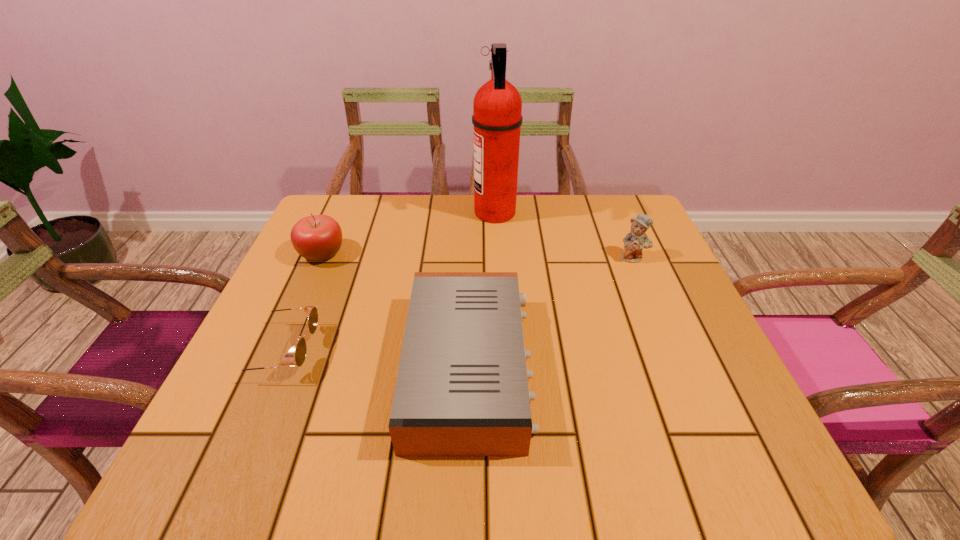
Identify the location of the farthest object. Image resolution: width=960 pixels, height=540 pixels. (497, 106).

Find the location of a particular element. Image resolution: width=960 pixels, height=540 pixels. the tallest object is located at coordinates (497, 106).

Image resolution: width=960 pixels, height=540 pixels. Find the location of `the rightmost object`. the rightmost object is located at coordinates point(635,241).

In order to click on apple in this screenshot , I will do `click(319, 237)`.

At what (x,y) coordinates should I click in order to perform the action: click on radio receiver. Please return your answer as a coordinate pair (x, y). This screenshot has width=960, height=540. Looking at the image, I should click on (462, 389).

Locate an element on the screen. The height and width of the screenshot is (540, 960). sunglasses is located at coordinates (311, 311).

The image size is (960, 540). I want to click on free region located on the side of the tallest object near the handle, so click(345, 213).

I want to click on vacant region located on the side of the tallest object near the handle, so click(x=423, y=213).

Where is `free point located on the side of the tallest object near the handle`? The height and width of the screenshot is (540, 960). free point located on the side of the tallest object near the handle is located at coordinates (351, 213).

Identify the location of free space located on the front-facing side of the rightmost object. Image resolution: width=960 pixels, height=540 pixels. (654, 308).